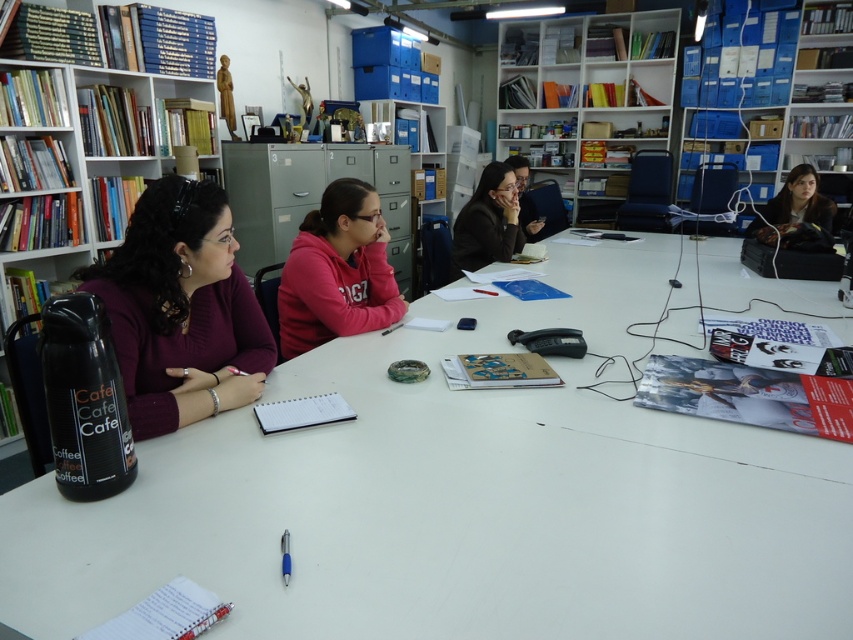
Question: Does matte purple sweater at left appear under white plastic bookshelf at upper center?

Choices:
 (A) no
 (B) yes

Answer: (B)

Question: Which object appears closest to the camera in this image?

Choices:
 (A) blue plastic pen at center
 (B) matte black jacket at upper right

Answer: (A)

Question: Does white plastic table at center come behind matte black jacket at upper right?

Choices:
 (A) yes
 (B) no

Answer: (B)

Question: Estimate the real-world distances between objects in this image. Which object is closer to the wooden bookshelf at left?

Choices:
 (A) matte black jacket at upper right
 (B) white plastic bookshelf at upper center
 (C) matte black jacket at center

Answer: (C)

Question: Is the position of matte purple sweater at left more distant than that of blue plastic pen at center?

Choices:
 (A) no
 (B) yes

Answer: (B)

Question: Among these points, which one is nearest to the camera?

Choices:
 (A) (289, 547)
 (B) (4, 198)
 (C) (656, 100)
 (D) (360, 250)

Answer: (A)